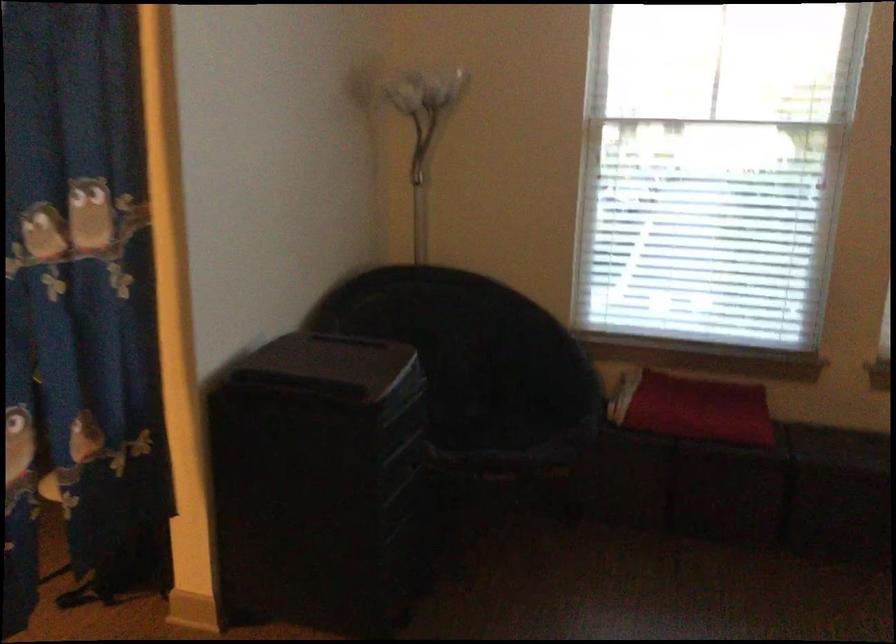
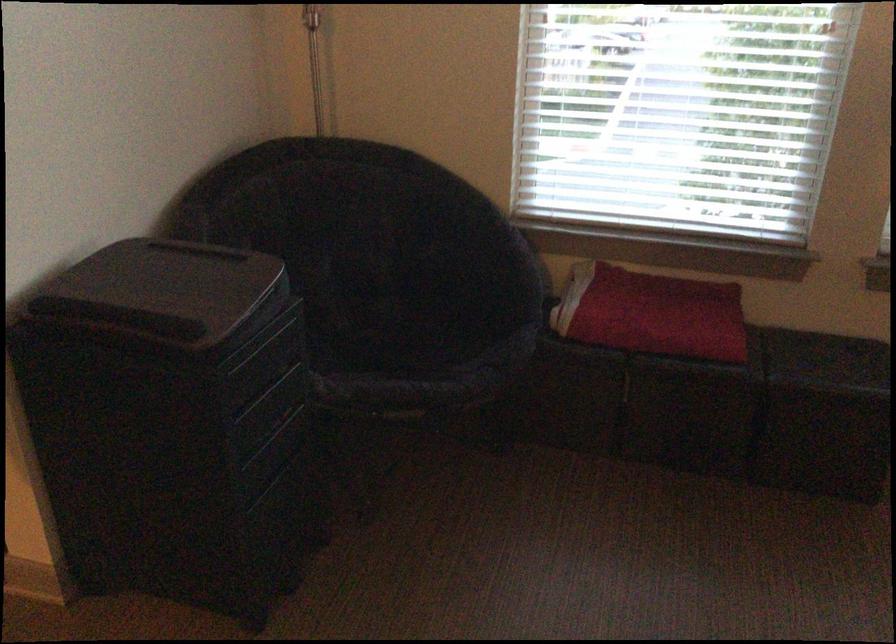
The point at (341, 357) is marked in the first image. Where is the corresponding point in the second image?

(188, 281)